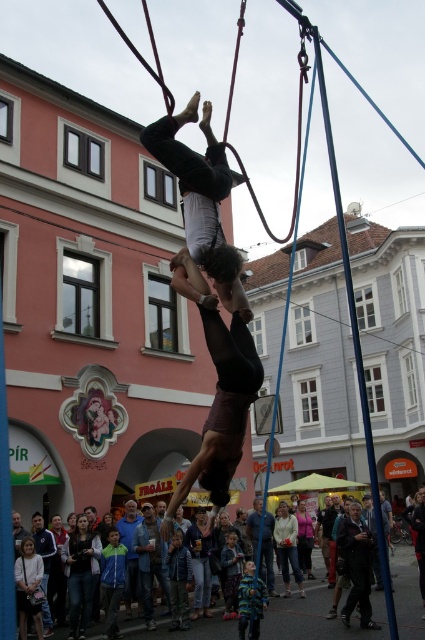
Question: Which object is farther from the camera taking this photo?

Choices:
 (A) dark clothing crowd at lower center
 (B) denim jacket at center
 (C) dark brown leather jacket at lower left

Answer: (B)

Question: Which of these objects is positioned closest to the dark clothing crowd at lower center?

Choices:
 (A) blue fabric jacket at center
 (B) denim jacket at center
 (C) dark gray sweater at lower left

Answer: (B)

Question: Which object is the farthest from the denim jacket at center?

Choices:
 (A) dark brown leather jacket at lower left
 (B) dark gray sweater at lower left
 (C) blue fabric jacket at center

Answer: (A)

Question: Is denim jacket at center to the left of blue fabric jacket at center from the viewer's perspective?

Choices:
 (A) yes
 (B) no

Answer: (B)

Question: Does light beige sweater at center appear on the left side of dark brown leather jacket at lower left?

Choices:
 (A) yes
 (B) no

Answer: (B)

Question: Considering the relative positions of dark clothing crowd at lower center and denim jacket at center in the image provided, where is dark clothing crowd at lower center located with respect to denim jacket at center?

Choices:
 (A) below
 (B) above

Answer: (A)